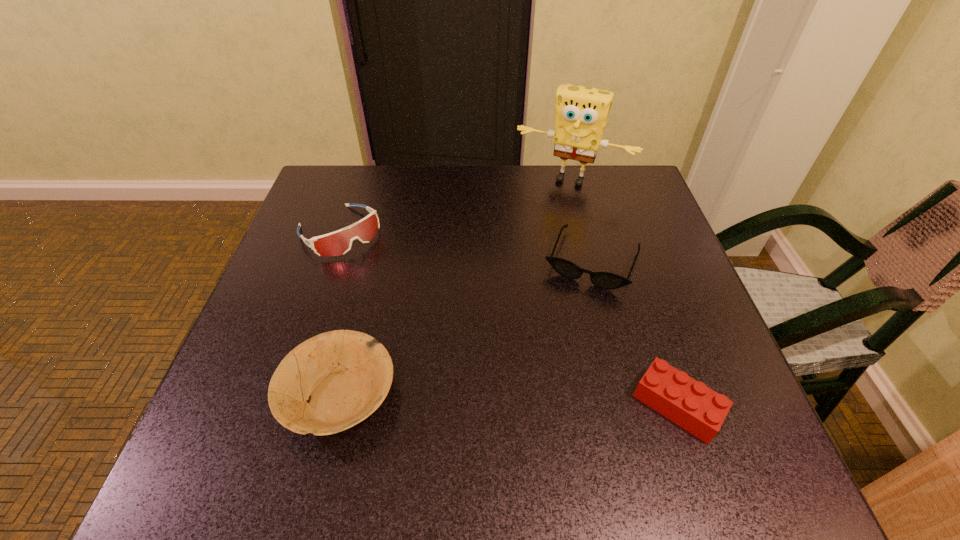
Locate an element on the screen. Image resolution: width=960 pixels, height=540 pixels. free location at the far edge of the desktop is located at coordinates (527, 179).

At what (x,y) coordinates should I click in order to perform the action: click on vacant space at the near edge of the desktop. Please return your answer as a coordinate pair (x, y). Looking at the image, I should click on (543, 409).

In the image, there is a desktop. Where is `vacant space at the left edge`? vacant space at the left edge is located at coordinates (337, 262).

You are a GUI agent. You are given a task and a screenshot of the screen. Output one action in this format:
    pyautogui.click(x=<x>, y=<y>)
    Task: Click on the vacant area at the right edge of the desktop
    This screenshot has width=960, height=540.
    Given the screenshot: What is the action you would take?
    pyautogui.click(x=613, y=256)

In order to click on free space at the far left corner of the desktop in this screenshot , I will do `click(335, 180)`.

Find the location of `vacant space at the far right corner of the desktop`. vacant space at the far right corner of the desktop is located at coordinates (636, 207).

Identify the location of vacant space at the near right corner of the desktop. The height and width of the screenshot is (540, 960). (738, 393).

Find the location of a particular element. vacant space that is in between the sunglasses and the Lego is located at coordinates (635, 333).

Where is `unoccupied area between the Lego and the tallest object`? unoccupied area between the Lego and the tallest object is located at coordinates (624, 292).

The width and height of the screenshot is (960, 540). In order to click on free space that is in between the bowl and the tallest object in this screenshot , I will do `click(455, 287)`.